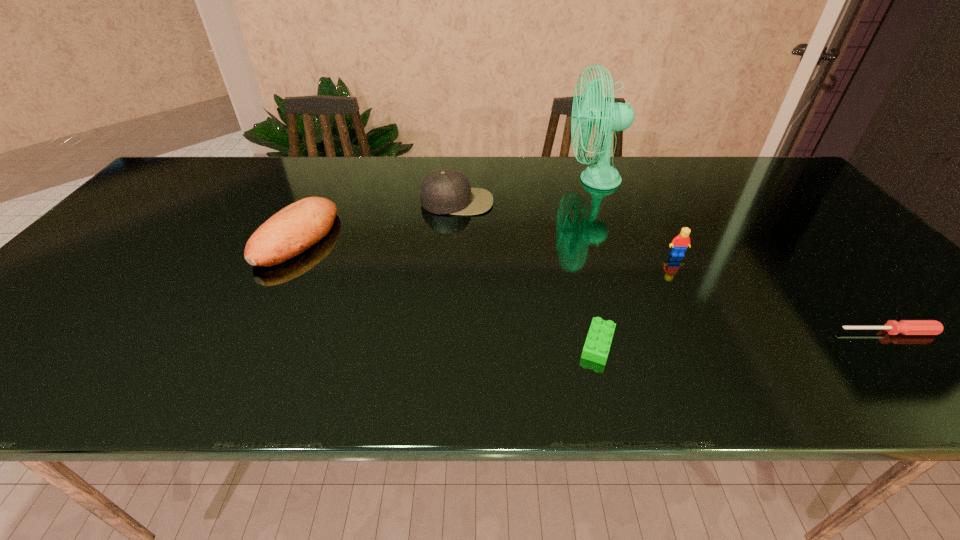
Image resolution: width=960 pixels, height=540 pixels. Identify the location of fan. (610, 117).

I want to click on cap, so click(x=444, y=191).

I want to click on the fifth shortest object, so click(444, 191).

Identify the location of the farther Lego. Image resolution: width=960 pixels, height=540 pixels. (679, 244).

I want to click on the right Lego, so click(x=679, y=244).

Locate an element on the screen. bread is located at coordinates (295, 228).

Image resolution: width=960 pixels, height=540 pixels. Identify the location of the nearer Lego. (597, 345).

You are a GUI agent. You are given a task and a screenshot of the screen. Output one action in this format:
    pyautogui.click(x=<x>, y=<y>)
    Task: Click on the left Lego
    
    Given the screenshot: What is the action you would take?
    pyautogui.click(x=597, y=345)

At what (x,y) coordinates should I click in order to perform the action: click on screwdriver. Please return your answer as a coordinate pair (x, y). The height and width of the screenshot is (540, 960). Looking at the image, I should click on (905, 327).

At what (x,y) coordinates should I click in order to perform the action: click on the shortest object. Please return your answer as a coordinate pair (x, y). The width and height of the screenshot is (960, 540). Looking at the image, I should click on [905, 327].